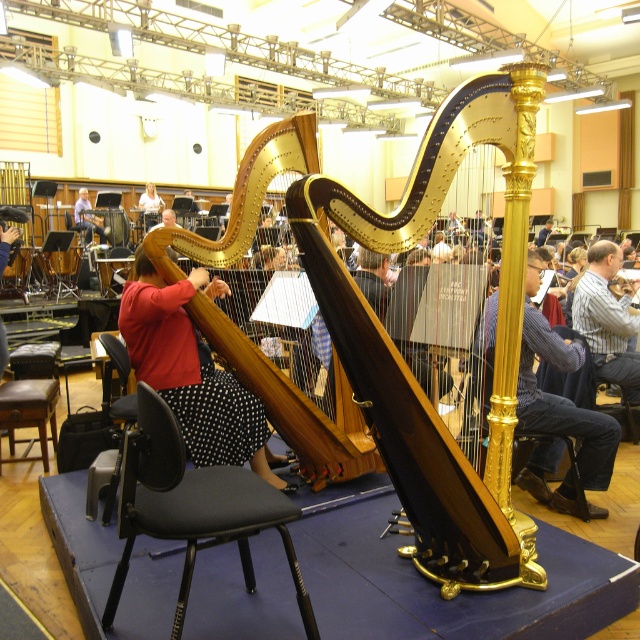
Based on the photo, between red fabric shirt at center and red fabric dress at center, which one is positioned higher?

red fabric dress at center

The image size is (640, 640). Identify the location of red fabric shirt at center. (88, 218).

What do you see at coordinates (560, 396) in the screenshot?
I see `wooden harp at center` at bounding box center [560, 396].

Who is more distant from viewer, (573, 413) or (621, 307)?

Positioned behind is point (621, 307).

What do you see at coordinates (560, 396) in the screenshot? I see `wooden harp at center` at bounding box center [560, 396].

Find the location of a particular element. wooden harp at center is located at coordinates (560, 396).

Is point (388, 401) farther from viewer compared to point (600, 449)?

No, it is not.

Is polished wood harp at center thinner than wooden harp at center?

No, polished wood harp at center is not thinner than wooden harp at center.

Is point (333, 275) positioned after point (566, 371)?

That is False.

You are a GUI agent. You are given a task and a screenshot of the screen. Output one action in this format:
    pyautogui.click(x=<x>, y=<y>)
    Task: Click on the polished wood harp at center
    
    Given the screenshot: What is the action you would take?
    pyautogui.click(x=404, y=362)